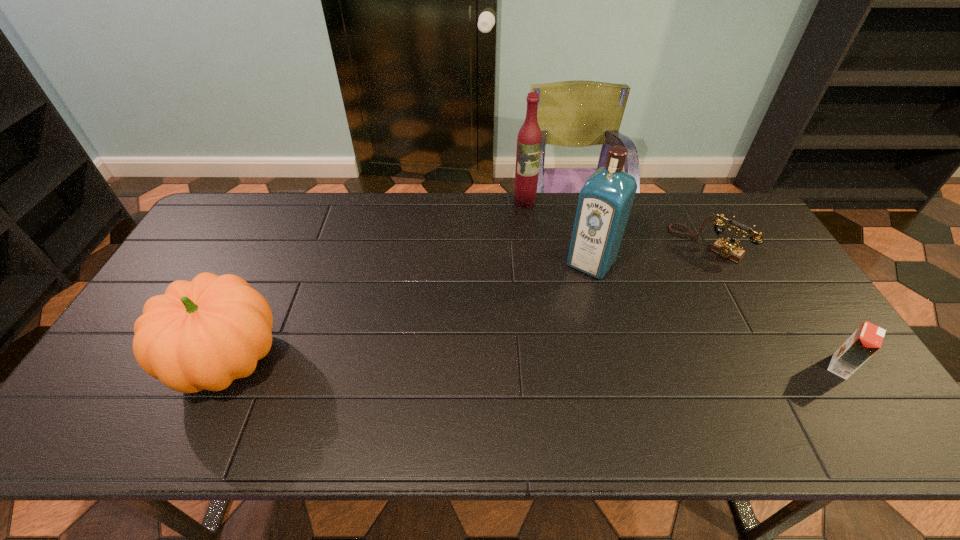
Find the location of a particular element. The image size is (960, 540). telephone that is at the far edge is located at coordinates (729, 249).

In order to click on pumpkin located in the near edge section of the desktop in this screenshot , I will do `click(202, 334)`.

Find the location of a particular element. orange juice located in the near edge section of the desktop is located at coordinates (867, 339).

The image size is (960, 540). I want to click on object positioned at the left edge, so click(202, 334).

Locate an element on the screen. The width and height of the screenshot is (960, 540). orange juice situated at the right edge is located at coordinates (867, 339).

Locate an element on the screen. Image resolution: width=960 pixels, height=540 pixels. telephone that is at the right edge is located at coordinates (729, 249).

Find the location of a particular element. This screenshot has height=540, width=960. object that is at the near left corner is located at coordinates (202, 334).

At what (x,y) coordinates should I click in order to perform the action: click on object located at the far right corner. Please return your answer as a coordinate pair (x, y). This screenshot has width=960, height=540. Looking at the image, I should click on (729, 249).

Image resolution: width=960 pixels, height=540 pixels. Identify the location of object located at the near right corner. (867, 339).

In order to click on blank space at the far edge in this screenshot , I will do `click(409, 220)`.